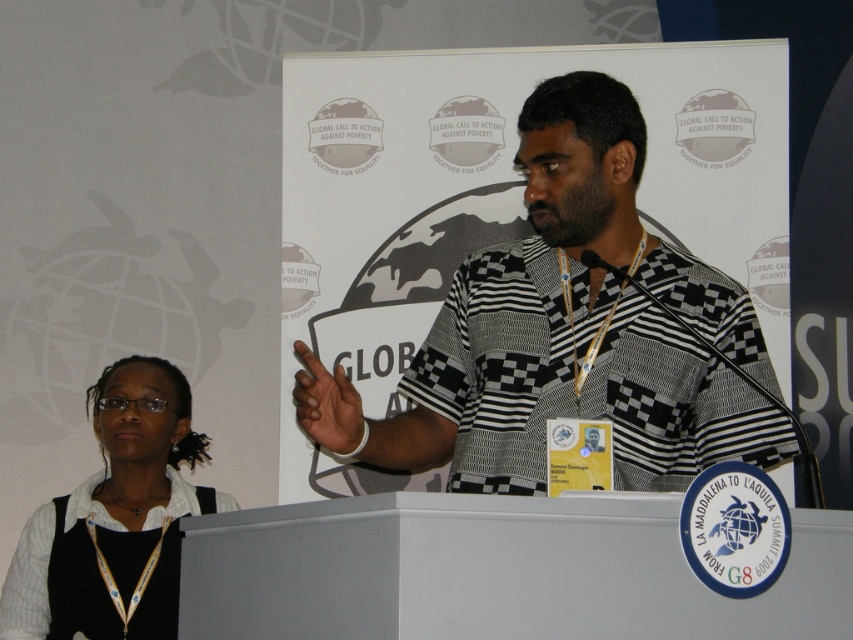
Can you confirm if black and white checkered shirt at center is thinner than white glossy shirt at lower left?

Incorrect, black and white checkered shirt at center's width is not less than white glossy shirt at lower left's.

Identify the location of black and white checkered shirt at center. This screenshot has height=640, width=853. (569, 332).

Find the location of a particular element. Image resolution: width=853 pixels, height=640 pixels. black and white checkered shirt at center is located at coordinates (569, 332).